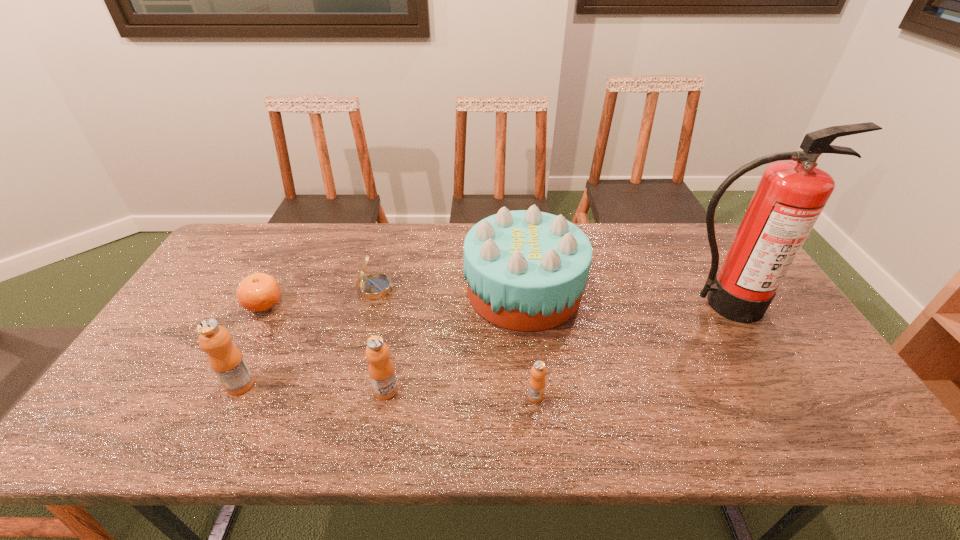
Identify the location of free space located 0.120m on the front label of the leftmost orange juice. The image size is (960, 540). (178, 384).

What are the coordinates of `free region located on the front label of the leftmost orange juice` in the screenshot? It's located at (141, 384).

The width and height of the screenshot is (960, 540). Identify the location of vacant space situated on the front label of the fourth shortest object. (505, 390).

Locate an element on the screen. vacant region located on the back of the clementine is located at coordinates (298, 239).

At what (x,y) coordinates should I click in order to perform the action: click on free space located on the left of the cake. Please return your answer as a coordinate pair (x, y). Image resolution: width=960 pixels, height=540 pixels. Looking at the image, I should click on (412, 290).

Locate an element on the screen. The height and width of the screenshot is (540, 960). blank area located 0.080m with the dial facing the compass is located at coordinates (424, 289).

Find the location of a particular element. Image resolution: width=960 pixels, height=540 pixels. vacant area situated on the front-facing side of the fire extinguisher is located at coordinates (748, 348).

Image resolution: width=960 pixels, height=540 pixels. I want to click on object located at the far edge, so click(526, 270).

Locate an element on the screen. object present at the right edge is located at coordinates point(790,196).

This screenshot has height=540, width=960. Identify the location of vacant point at the far edge. (448, 223).